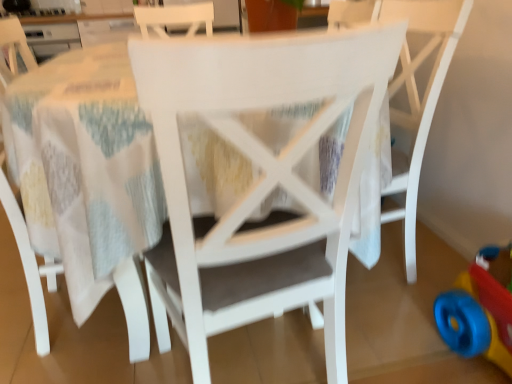
Question: Is white matte chair at center, which is the 1th chair in left-to-right order, wider than white matte chair at center, which is the second chair from left to right?

Choices:
 (A) no
 (B) yes

Answer: (A)

Question: From a real-world perspective, is white matte chair at center, which is the 1th chair in left-to-right order, physically above white matte chair at center, which is the second chair from left to right?

Choices:
 (A) yes
 (B) no

Answer: (A)

Question: Is white matte chair at center, which ranks as the third chair in right-to-left order, bigger than white matte chair at center, which is the second chair from left to right?

Choices:
 (A) no
 (B) yes

Answer: (A)

Question: Considering the relative positions of white matte chair at center, which is the 1th chair in left-to-right order, and white matte chair at center, which is the 2th chair in right-to-left order, in the image provided, is white matte chair at center, which is the 1th chair in left-to-right order, to the left of white matte chair at center, which is the 2th chair in right-to-left order, from the viewer's perspective?

Choices:
 (A) no
 (B) yes

Answer: (B)

Question: Is white matte chair at center, which ranks as the third chair in right-to-left order, aimed at white matte chair at center, which is the second chair from left to right?

Choices:
 (A) yes
 (B) no

Answer: (B)

Question: Is white matte chair at center, which is the second chair from left to right, wider or thinner than white matte chair at center, the 1th chair positioned from the right?

Choices:
 (A) wide
 (B) thin

Answer: (A)

Question: In the image, is white matte chair at center, which is the 2th chair in right-to-left order, on the left side or the right side of white matte chair at center, the 1th chair positioned from the right?

Choices:
 (A) left
 (B) right

Answer: (A)

Question: Is white matte chair at center, which is the second chair from left to right, in front of or behind white matte chair at center, which is the third chair in left-to-right order, in the image?

Choices:
 (A) behind
 (B) front

Answer: (B)

Question: Does point (337, 89) appear closer or farther from the camera than point (414, 274)?

Choices:
 (A) farther
 (B) closer

Answer: (B)

Question: In terms of height, does white matte chair at center, which is the third chair in left-to-right order, look taller or shorter compared to white matte chair at center, which is the second chair from left to right?

Choices:
 (A) short
 (B) tall

Answer: (B)

Question: From the image's perspective, relative to white matte chair at center, which is the 2th chair in right-to-left order, is white matte chair at center, which is the third chair in left-to-right order, above or below?

Choices:
 (A) above
 (B) below

Answer: (A)

Question: Relative to white matte chair at center, which is the second chair from left to right, is white matte chair at center, which is the third chair in left-to-right order, in front or behind?

Choices:
 (A) front
 (B) behind

Answer: (B)

Question: Based on their sizes in the image, would you say white matte chair at center, the 1th chair positioned from the right, is bigger or smaller than white matte chair at center, which is the second chair from left to right?

Choices:
 (A) big
 (B) small

Answer: (B)

Question: Considering their positions, is white matte chair at center, which is the 2th chair in right-to-left order, located in front of or behind rubberized plastic toy at lower right?

Choices:
 (A) front
 (B) behind

Answer: (A)

Question: Which is correct: white matte chair at center, which is the second chair from left to right, is inside rubberized plastic toy at lower right, or outside of it?

Choices:
 (A) inside
 (B) outside

Answer: (B)